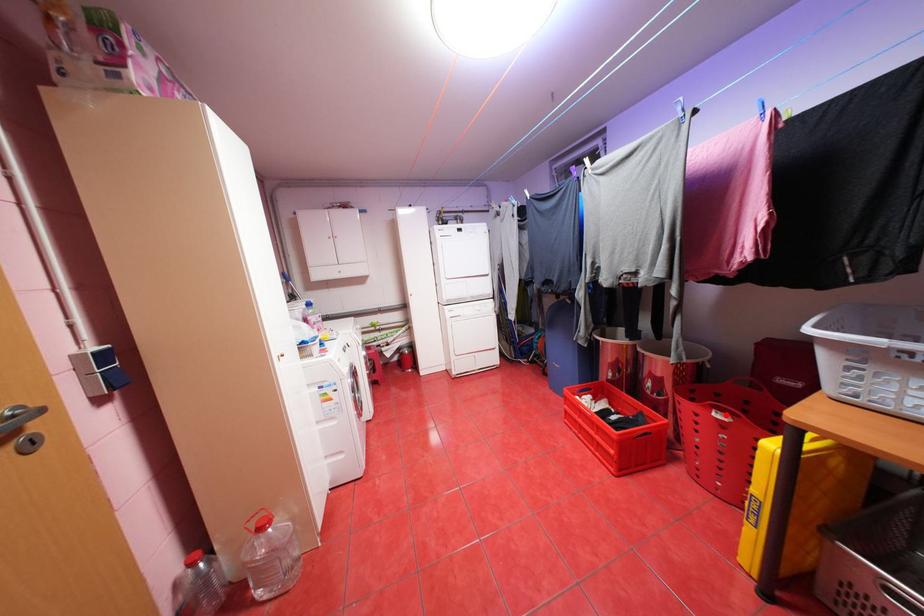
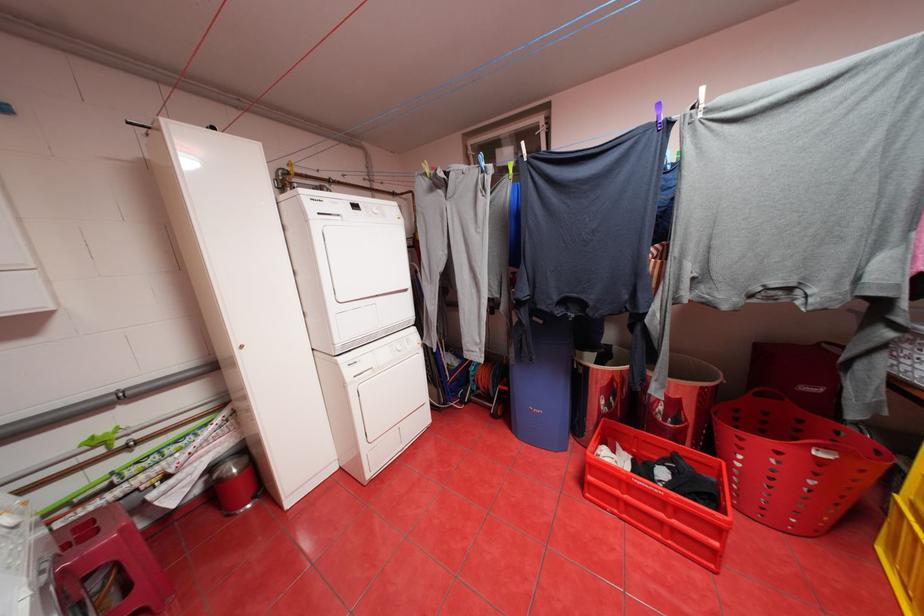
Find the pixel in the second image that matches the highlighted location in the first image.

(828, 453)